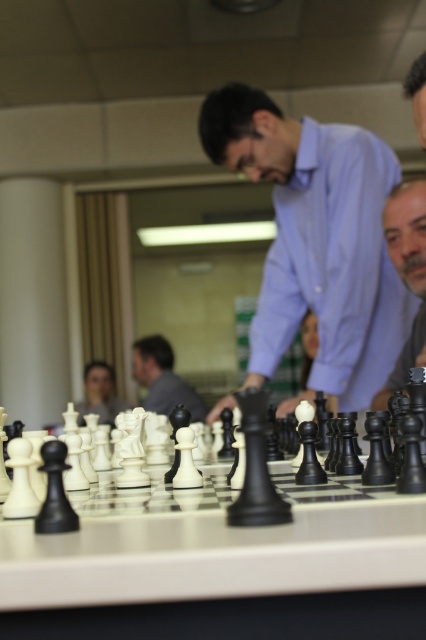
Question: Estimate the real-world distances between objects in this image. Which object is farther from the matte blue shirt at center?

Choices:
 (A) smooth black chess piece at right
 (B) black glossy chess pieces at center

Answer: (B)

Question: Can you confirm if matte blue shirt at center is thinner than matte black chess piece at center?

Choices:
 (A) no
 (B) yes

Answer: (A)

Question: Which object appears closest to the camera in this image?

Choices:
 (A) matte black chess piece at center
 (B) black glossy chess pieces at center
 (C) smooth black chess piece at right

Answer: (B)

Question: Is black glossy chess pieces at center further to the viewer compared to smooth black chess piece at right?

Choices:
 (A) yes
 (B) no

Answer: (B)

Question: Does black glossy chess pieces at center appear over smooth black chess piece at right?

Choices:
 (A) yes
 (B) no

Answer: (B)

Question: Which of the following is the farthest from the observer?

Choices:
 (A) matte blue shirt at center
 (B) black glossy chess pieces at center
 (C) smooth black chess piece at right

Answer: (A)